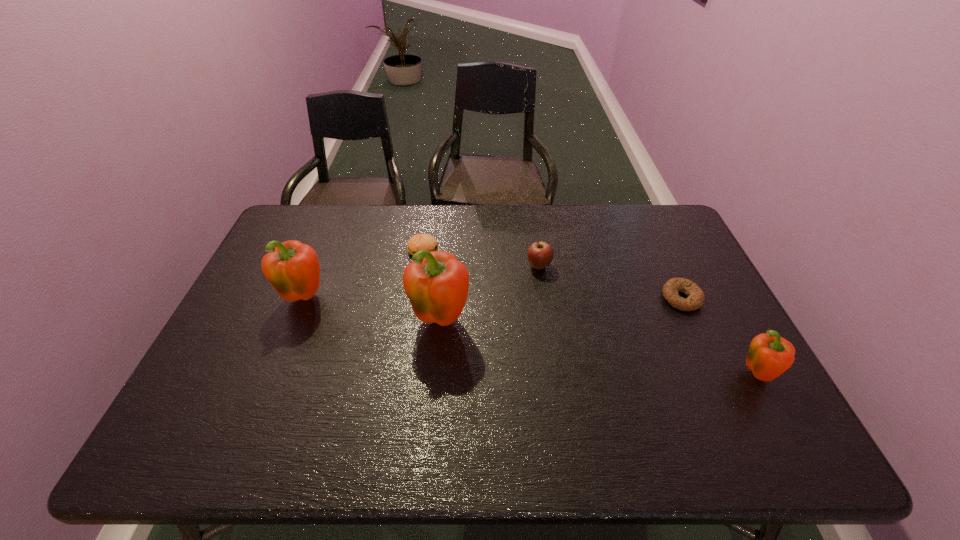
If the aim is uniform spacing by inserting an additional pepper among them, please point to a vacant space for this new pepper. Please provide its 2D coordinates. Your answer should be formatted as a tuple, i.e. [(x, y)], where the tuple contains the x and y coordinates of a point satisfying the conditions above.

[(590, 347)]